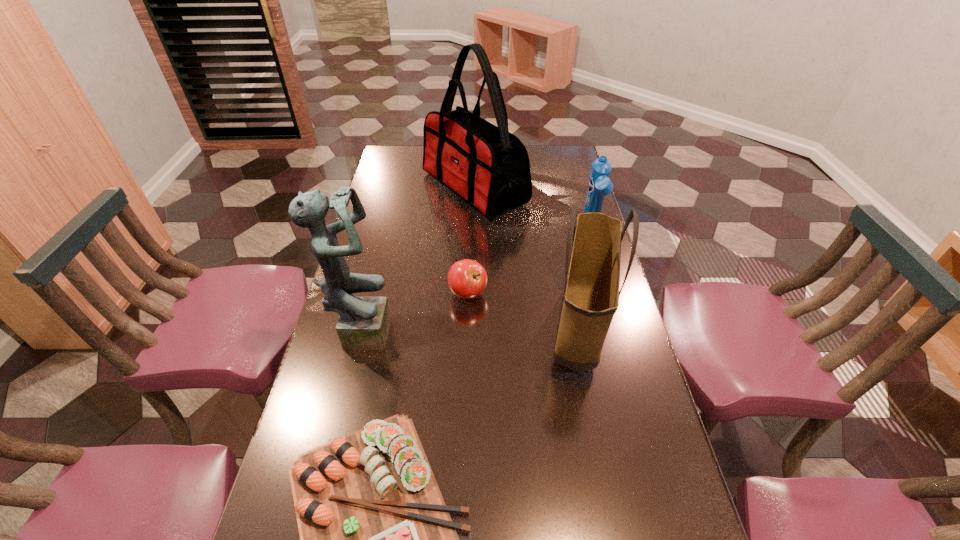
Where is `the tallest object`? The height and width of the screenshot is (540, 960). the tallest object is located at coordinates (487, 166).

Where is `sculpture`? Image resolution: width=960 pixels, height=540 pixels. sculpture is located at coordinates (364, 322).

Identify the location of the third tallest object. The height and width of the screenshot is (540, 960). (591, 294).

Identify the location of shampoo. (599, 185).

You are a GUI agent. You are given a task and a screenshot of the screen. Output one action in this format:
    pyautogui.click(x=<x>, y=<y>)
    Task: Click on the fifth tallest object
    The width and height of the screenshot is (960, 540).
    Given the screenshot: What is the action you would take?
    pyautogui.click(x=467, y=279)

At what (x,y) coordinates should I click in order to perform the action: click on free space located 0.280m on the front of the duffel bag. Please return your answer as a coordinate pair (x, y). Looking at the image, I should click on (473, 278).

Image resolution: width=960 pixels, height=540 pixels. Find the location of `free space located 0.120m on the face of the sculpture`. free space located 0.120m on the face of the sculpture is located at coordinates (434, 329).

Locate an element on the screen. This screenshot has width=960, height=540. free location located 0.230m on the back of the fourth shortest object is located at coordinates (560, 239).

Where is `vacant position located on the front of the fourth tallest object`? vacant position located on the front of the fourth tallest object is located at coordinates (614, 313).

Where is `vacant space located 0.160m on the front of the second shortest object`? vacant space located 0.160m on the front of the second shortest object is located at coordinates (467, 352).